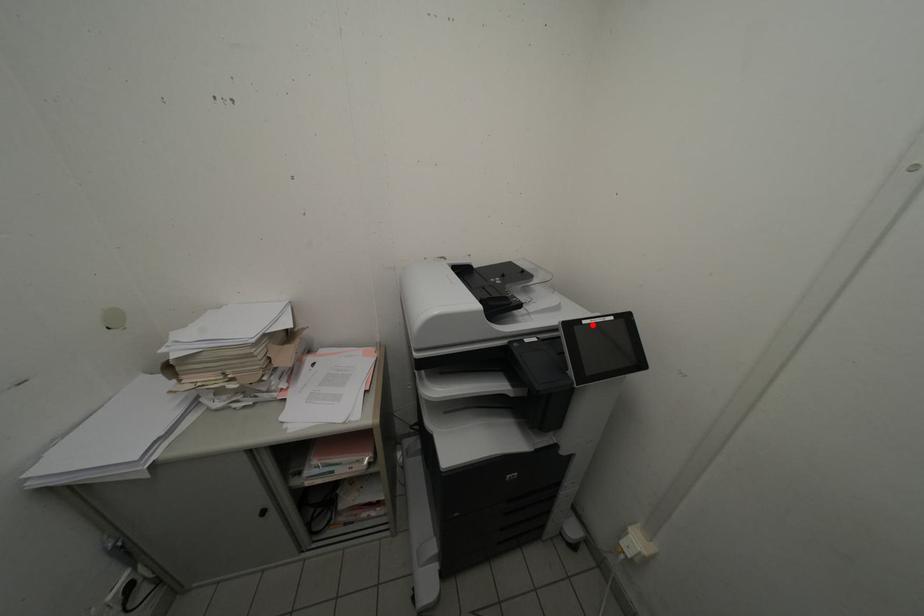
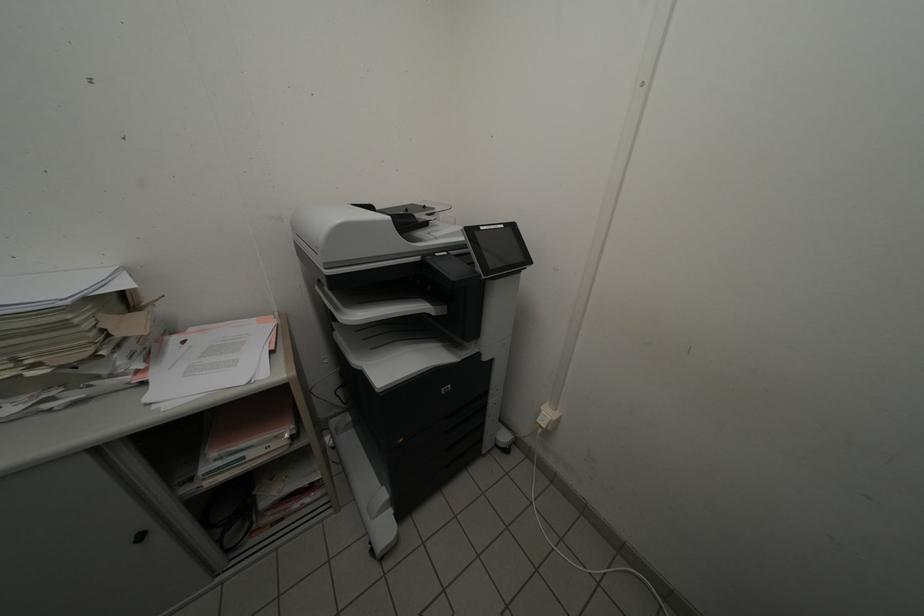
In the second image, find the point that corresponds to the highlighted location in the first image.

(490, 230)